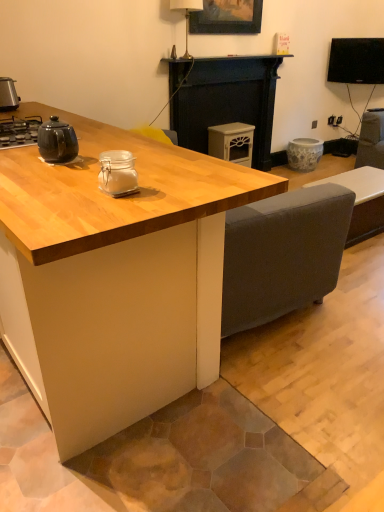
I want to click on free location in front of clear glass jar at center, which is counted as the 4th appliance, starting from the back, so click(x=109, y=209).